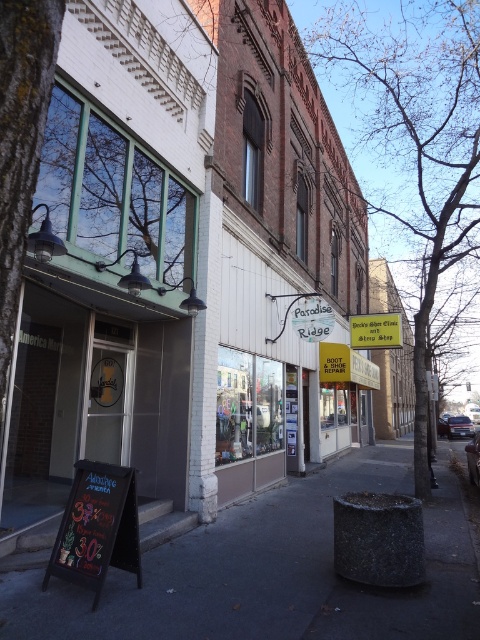
Is dark asphalt pavement at center bigger than chalkboard sign at lower left?

Indeed, dark asphalt pavement at center has a larger size compared to chalkboard sign at lower left.

Who is more distant from viewer, (x=312, y=490) or (x=113, y=531)?

The point (x=312, y=490) is behind.

The height and width of the screenshot is (640, 480). What do you see at coordinates (272, 572) in the screenshot? I see `dark asphalt pavement at center` at bounding box center [272, 572].

The image size is (480, 640). In order to click on dark asphalt pavement at center in this screenshot , I will do `click(272, 572)`.